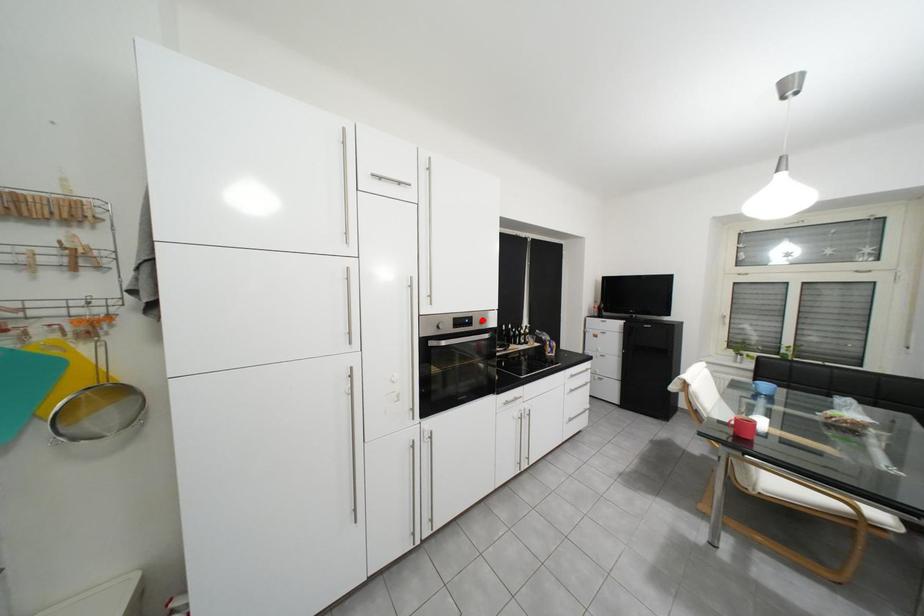
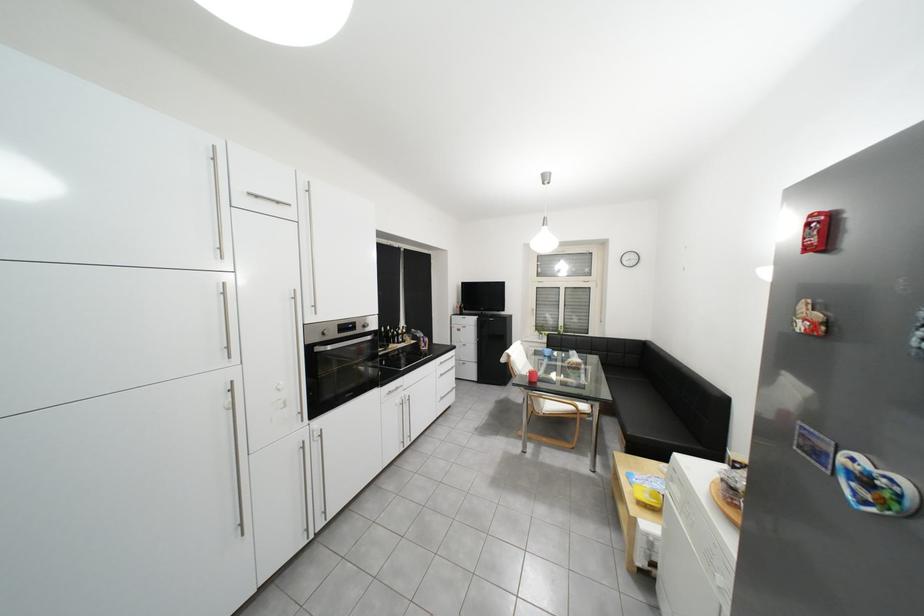
In the second image, find the point that corresponds to the highlighted location in the first image.

(366, 325)